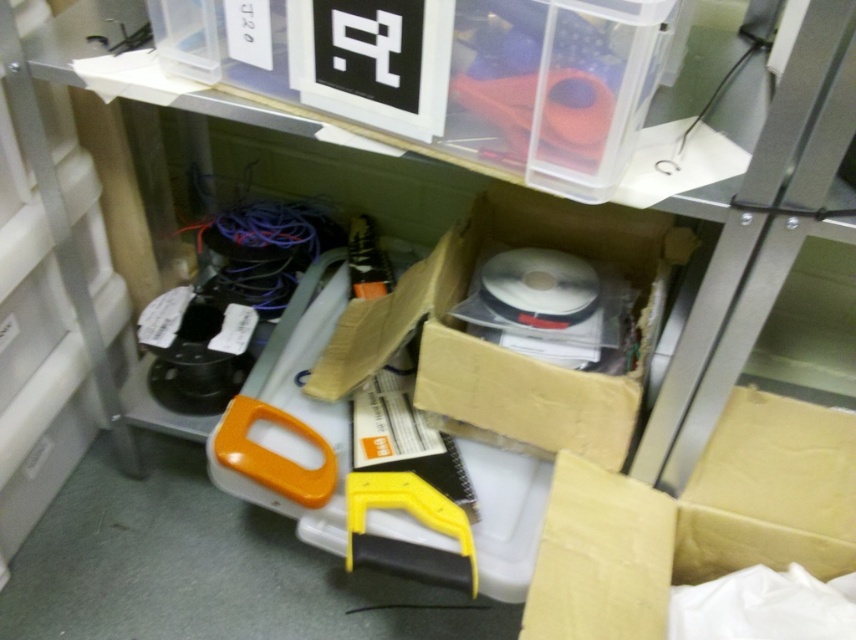
Does point (367, 356) come behind point (519, 80)?

That is True.

Which is behind, point (670, 248) or point (474, 109)?

The point (670, 248) is more distant.

Where is `cardboard box at center`? Image resolution: width=856 pixels, height=640 pixels. cardboard box at center is located at coordinates (506, 349).

Between point (372, 497) and point (568, 74), which one is positioned in front?

Point (568, 74) is more forward.

Is point (462, 509) closer to camera compared to point (518, 104)?

No.

You are a GUI agent. You are given a task and a screenshot of the screen. Output one action in this format:
    pyautogui.click(x=<x>, y=<y>)
    Task: Click on the yellow rubber clamp at center
    
    Given the screenshot: What is the action you would take?
    pyautogui.click(x=406, y=508)

Is brown cardboard box at lower right to the left of cardboard box at center from the viewer's perspective?

No, brown cardboard box at lower right is not to the left of cardboard box at center.

From the picture: Measure the distance from brown cardboard box at lower right to cardboard box at center.

The distance of brown cardboard box at lower right from cardboard box at center is 8.95 inches.

Find the location of a particular element. The width and height of the screenshot is (856, 640). brown cardboard box at lower right is located at coordinates 694,520.